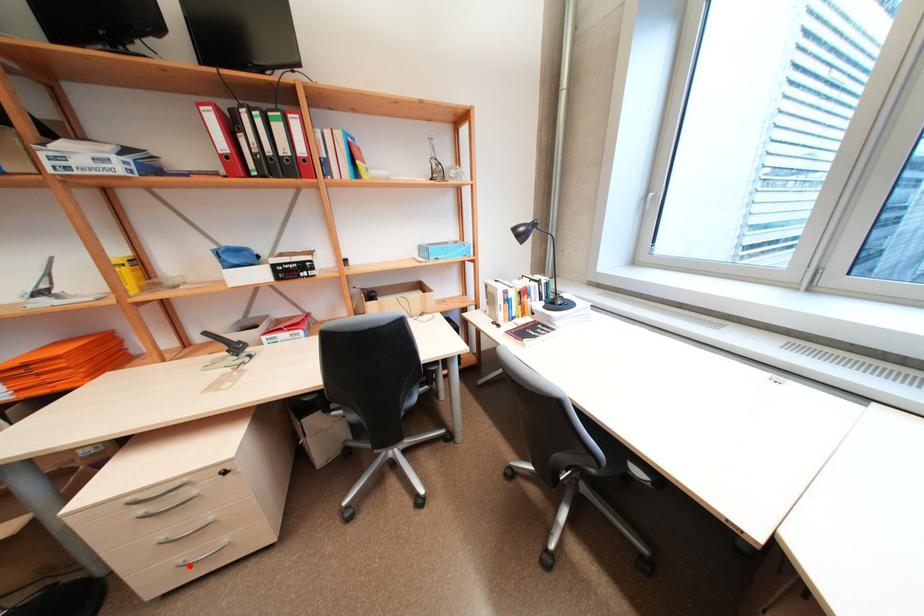
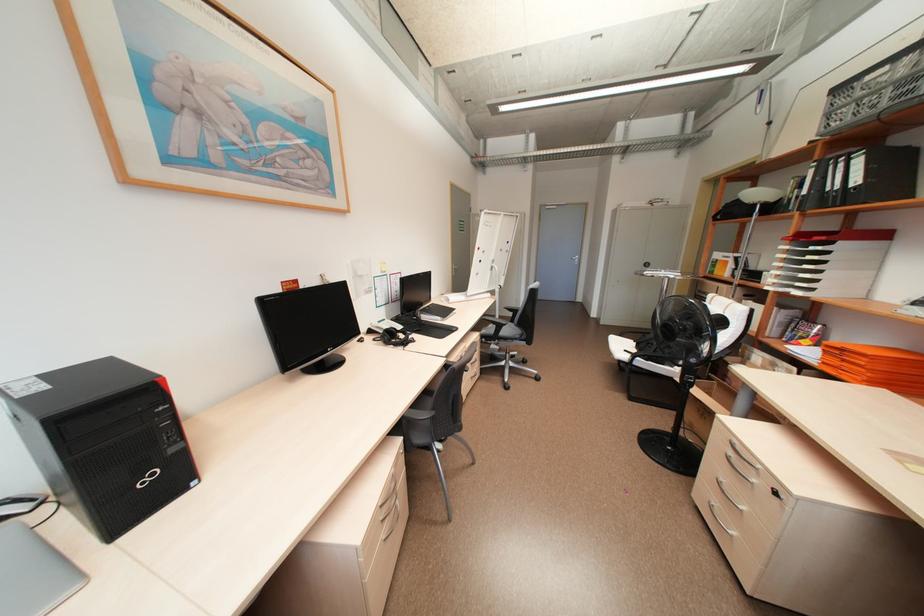
In the second image, find the point that corresponds to the highlighted location in the first image.

(716, 506)